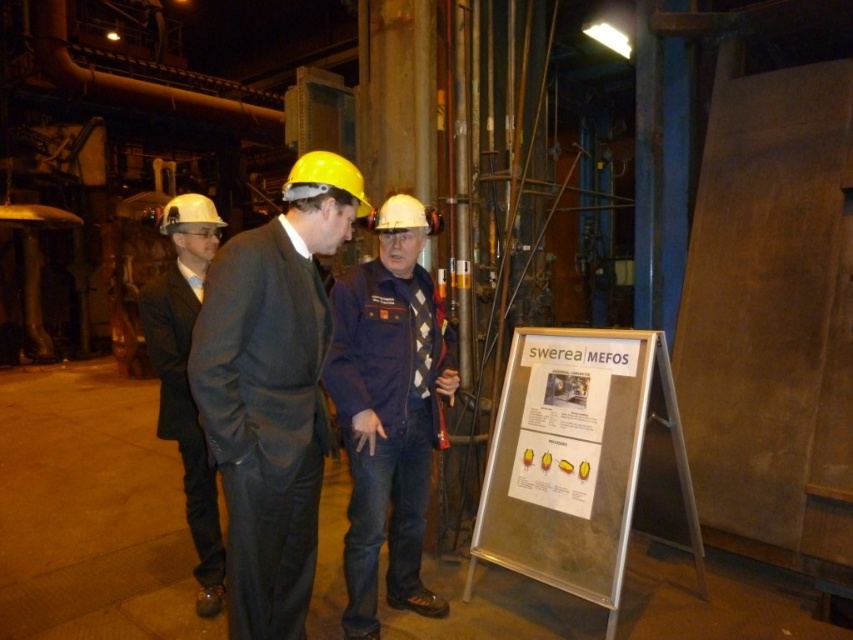
Question: Which point appears farthest from the camera in this image?

Choices:
 (A) [190, 529]
 (B) [317, 465]
 (C) [368, 554]
 (D) [538, 477]

Answer: (A)

Question: Can you confirm if matte black suit at center is wider than blue denim jeans at center?

Choices:
 (A) yes
 (B) no

Answer: (B)

Question: Is blue denim jeans at center smaller than matte black suit at left?

Choices:
 (A) no
 (B) yes

Answer: (A)

Question: Estimate the real-world distances between objects in this image. Which object is farther from the matte black suit at center?

Choices:
 (A) matte black suit at left
 (B) white paper at center

Answer: (B)

Question: Which of the following is the closest to the observer?

Choices:
 (A) matte black suit at left
 (B) blue denim jeans at center
 (C) matte black suit at center
 (D) white paper at center

Answer: (C)

Question: Is white paper at center to the right of matte black suit at left from the viewer's perspective?

Choices:
 (A) yes
 (B) no

Answer: (A)